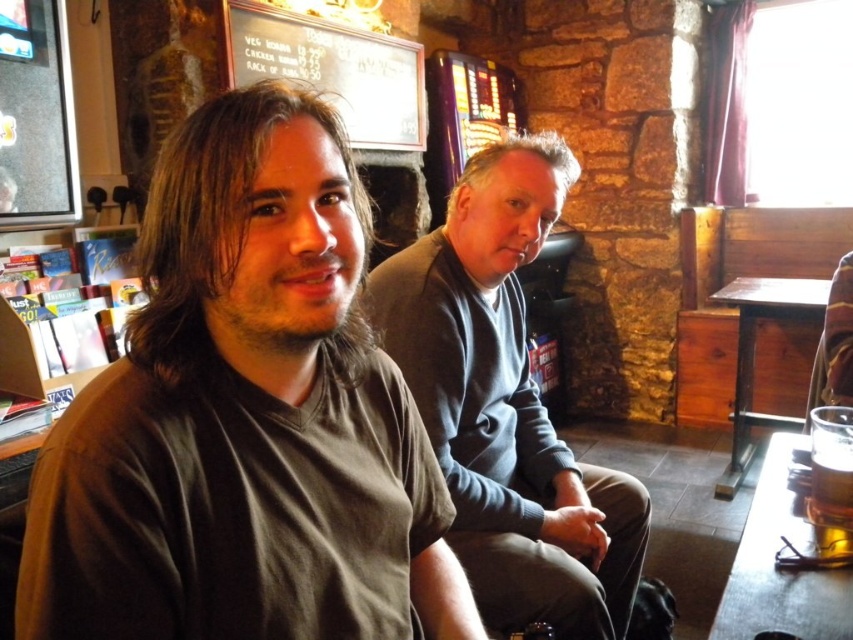
Question: Is wooden table at right above golden amber liquid at lower right?

Choices:
 (A) yes
 (B) no

Answer: (A)

Question: Among these objects, which one is nearest to the camera?

Choices:
 (A) wooden table at lower right
 (B) brown matte shirt at left
 (C) dark gray sweater at center
 (D) golden amber liquid at lower right

Answer: (B)

Question: Which object is closer to the camera taking this photo?

Choices:
 (A) dark gray sweater at center
 (B) wooden table at lower right
 (C) golden amber liquid at lower right

Answer: (B)

Question: Which object is positioned farthest from the brown matte shirt at left?

Choices:
 (A) golden amber liquid at lower right
 (B) wooden table at lower right
 (C) wooden table at right

Answer: (C)

Question: Is dark gray sweater at center to the right of wooden table at right from the viewer's perspective?

Choices:
 (A) yes
 (B) no

Answer: (B)

Question: Does brown matte shirt at left appear on the left side of wooden table at lower right?

Choices:
 (A) no
 (B) yes

Answer: (B)